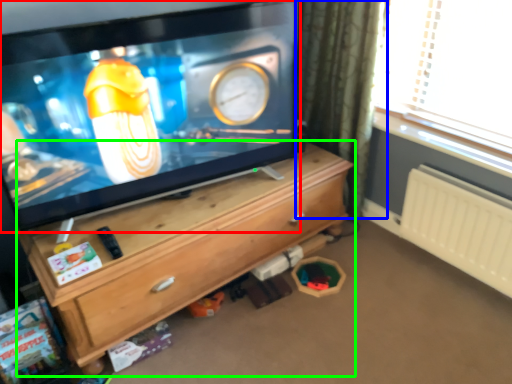
Question: Which object is positioned closest to television (highlighted by a red box)? Select from curtain (highlighted by a blue box) and chest of drawers (highlighted by a green box).

Choices:
 (A) curtain
 (B) chest of drawers

Answer: (B)